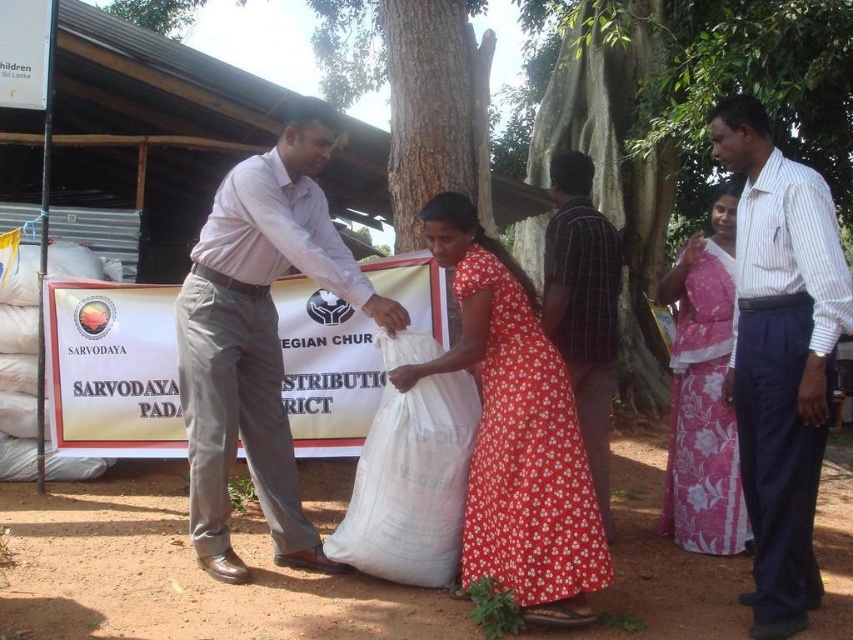
Question: Which point is closer to the camera?

Choices:
 (A) pink floral fabric dress at right
 (B) white striped shirt at right
 (C) light gray trousers at center

Answer: (B)

Question: Does white fabric sack at center have a smaller size compared to green leafy tree at upper center?

Choices:
 (A) yes
 (B) no

Answer: (A)

Question: Which of the following is the closest to the observer?

Choices:
 (A) (418, 355)
 (B) (259, 376)
 (C) (711, 484)
 (D) (811, 196)

Answer: (D)

Question: Which point is closer to the camera?

Choices:
 (A) (119, 16)
 (B) (509, 468)
 (C) (281, 241)

Answer: (B)

Question: Is plaid shirt at center positioned before green leafy tree at upper center?

Choices:
 (A) no
 (B) yes

Answer: (B)

Question: Does white striped shirt at right have a greater width compared to white fabric sack at center?

Choices:
 (A) yes
 (B) no

Answer: (B)